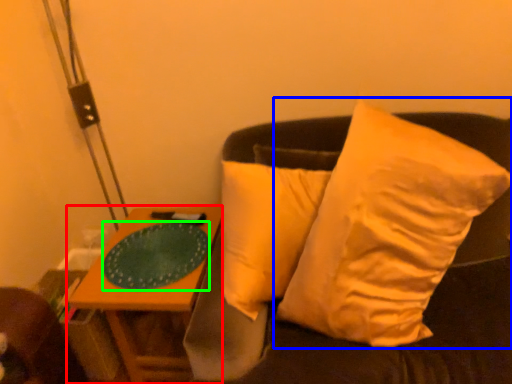
Question: Which object is positioned farthest from table (highlighted by a red box)? Select from pillow (highlighted by a blue box) and glass plate (highlighted by a green box).

Choices:
 (A) pillow
 (B) glass plate

Answer: (A)